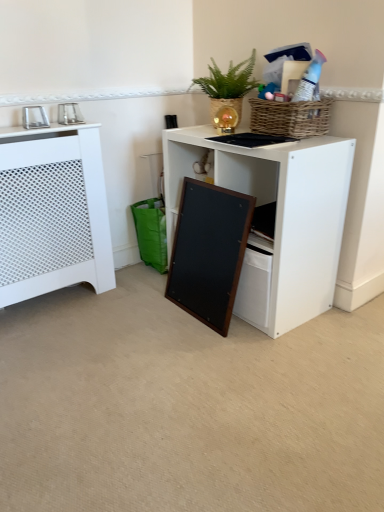
Find the location of a particular element. This screenshot has height=512, width=384. vacant region to the right of metallic silver photo frame at upper left, the first appliance viewed from the left is located at coordinates (62, 131).